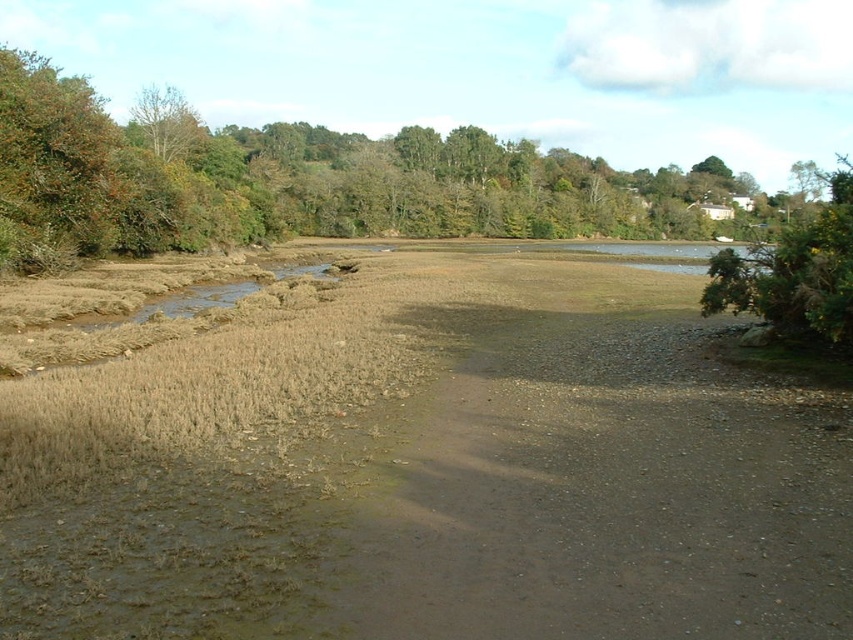
You are a hiker who wants to reach the green leafy tree at upper left from the brown dirt track at center. Which direction should you move relative to the tree?

The brown dirt track at center is located below the green leafy tree at upper left, so to reach the tree, you should move upward towards the green leafy tree at upper left from the dirt track.

You are standing at the center of the tidal flat and see a point marked at coordinate (x=294, y=180). What object is located at that point?

The point at coordinate (x=294, y=180) indicates a green leafy tree at upper left.

You are a hiker trying to cross the tidal flat. You see the green leafy tree at upper left and the green leafy bush at right. Which one can you use as a landmark to navigate towards the dense greenery on the far side of the water?

The green leafy tree at upper left is larger than the green leafy bush at right, so it would be a better landmark to navigate towards the dense greenery on the far side of the water.